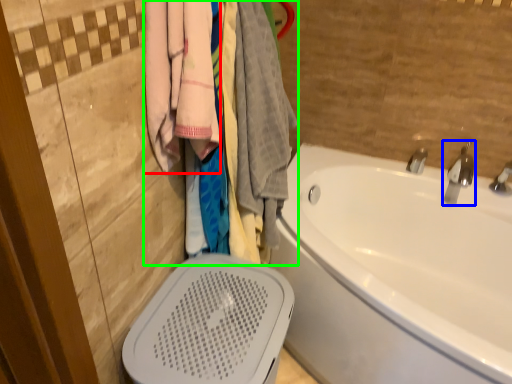
Question: Estimate the real-world distances between objects in this image. Which object is farther from clothing (highlighted by a red box), tap (highlighted by a blue box) or closet (highlighted by a green box)?

Choices:
 (A) tap
 (B) closet

Answer: (A)